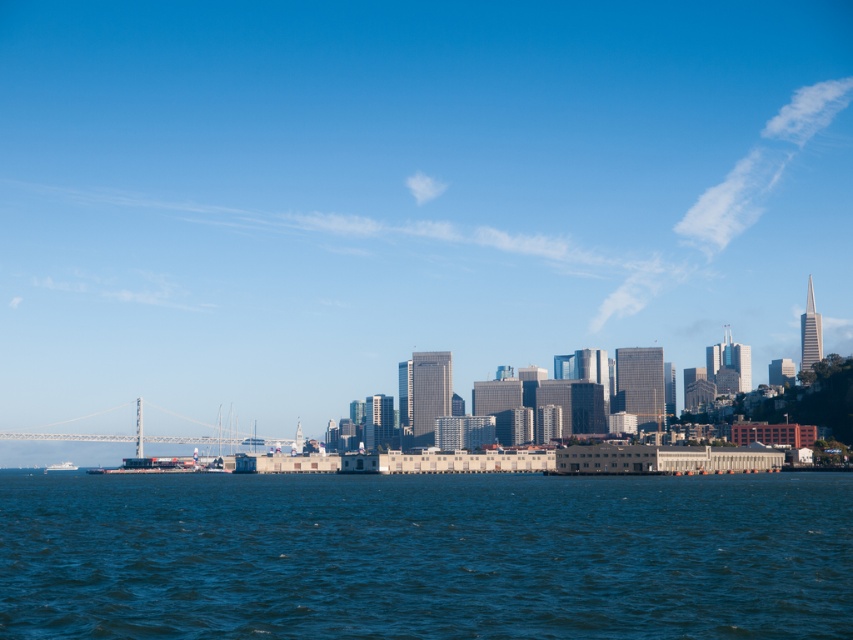
You are a photographer planning to capture the entire skyline and the boat in one shot. Given that your camera can only accommodate objects up to the width of the white glossy boat at lower left, will you be able to fit the transparent glass skyscrapers at center into the frame?

The transparent glass skyscrapers at center are wider than the white glossy boat at lower left, so they will not fit within the camera frame designed for the boat width.

You are standing at the edge of the waterfront and see two points in the image. The first point is located at coordinates point (619, 538) and the second at point (64, 468). Which point is nearer to your current position?

Point (619, 538) is closer to the camera than point (64, 468), so the first point is nearer to your current position.

You are a photographer planning to capture the entire city skyline in one shot. You notice the transparent glass skyscrapers at center and the white glossy boat at lower left in your viewfinder. Given their sizes, which object will appear bigger in your photo?

The transparent glass skyscrapers at center will appear bigger in the photo since they are described as having a larger size compared to the white glossy boat at lower left.